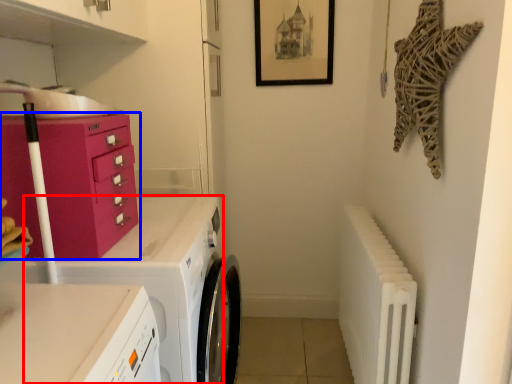
Question: Which point is closer to the camera, home appliance (highlighted by a red box) or chest of drawers (highlighted by a blue box)?

Choices:
 (A) home appliance
 (B) chest of drawers

Answer: (B)